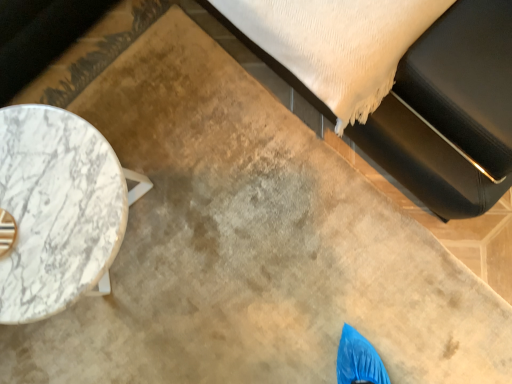
Question: Considering the relative sizes of white marble table at left and black leather bed at upper right in the image provided, is white marble table at left shorter than black leather bed at upper right?

Choices:
 (A) no
 (B) yes

Answer: (B)

Question: Is black leather bed at upper right at the back of white marble table at left?

Choices:
 (A) yes
 (B) no

Answer: (B)

Question: Does white marble table at left come in front of black leather bed at upper right?

Choices:
 (A) yes
 (B) no

Answer: (B)

Question: Could you tell me if white marble table at left is turned towards black leather bed at upper right?

Choices:
 (A) yes
 (B) no

Answer: (B)

Question: Is white marble table at left at the right side of black leather bed at upper right?

Choices:
 (A) no
 (B) yes

Answer: (A)

Question: From the image's perspective, would you say white marble table at left is shown under black leather bed at upper right?

Choices:
 (A) no
 (B) yes

Answer: (B)

Question: Does black leather bed at upper right have a lesser width compared to white marble table at left?

Choices:
 (A) yes
 (B) no

Answer: (B)

Question: From the image's perspective, is black leather bed at upper right under white marble table at left?

Choices:
 (A) yes
 (B) no

Answer: (B)

Question: Is black leather bed at upper right outside white marble table at left?

Choices:
 (A) no
 (B) yes

Answer: (B)

Question: Does black leather bed at upper right have a smaller size compared to white marble table at left?

Choices:
 (A) no
 (B) yes

Answer: (A)

Question: Is the position of black leather bed at upper right more distant than that of white marble table at left?

Choices:
 (A) yes
 (B) no

Answer: (B)

Question: Is black leather bed at upper right at the left side of white marble table at left?

Choices:
 (A) yes
 (B) no

Answer: (B)

Question: From a real-world perspective, is white marble table at left above or below black leather bed at upper right?

Choices:
 (A) above
 (B) below

Answer: (B)